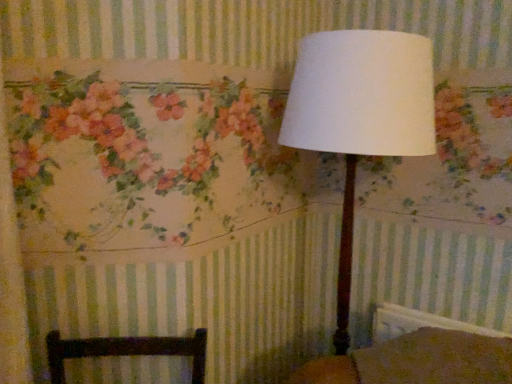
I want to click on white fabric lampshade at upper right, so click(x=360, y=115).

Describe the element at coordinates (360, 115) in the screenshot. Image resolution: width=512 pixels, height=384 pixels. I see `white fabric lampshade at upper right` at that location.

What is the approximate width of white fabric lampshade at upper right?

17.33 inches.

Where is `white fabric lampshade at upper right`? white fabric lampshade at upper right is located at coordinates (360, 115).